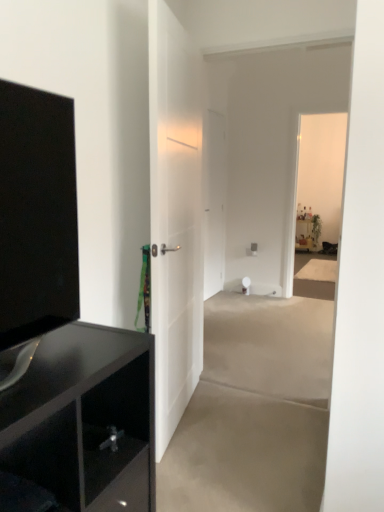
Where is `free space on the front side of white glossy door at center, marked as the first door in a back-to-front arrangement`? The width and height of the screenshot is (384, 512). free space on the front side of white glossy door at center, marked as the first door in a back-to-front arrangement is located at coordinates (226, 302).